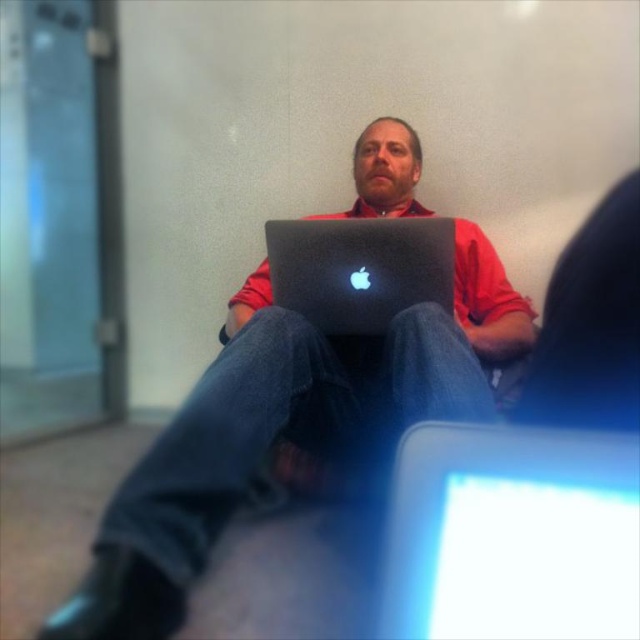
You are a delivery person who needs to place a package on the desk where the sleek silver laptop at center is located. The package requires a minimum of 10 cm of space to the left and right of the laptop. Can you determine if there is enough space on the desk around the laptop?

The sleek silver laptop at center is located at point [512,532]. However, without knowing the desk dimensions or the available space around the laptop, it is impossible to determine if there is enough space to place the package with the required 10 cm clearance on both sides. Additional information about the desk size and the laptop position relative to desk edges is needed to make this assessment.

You are standing in the room and want to move from the point at the bottom left corner to the point at the bottom right corner. There are two points marked in the image, one at coordinates point (291, 392) and another at point (444, 625). Which point is closer to your starting position at the bottom left corner?

The point at (291, 392) is closer to the bottom left corner because it is positioned behind the point at (444, 625), meaning it is nearer to the starting point.

You are a delivery person who needs to place a small package on the desk next to the sleek silver laptop at center. The package is 12 inches long. Can you fit the package horizontally next to the laptop without moving it?

The sleek silver laptop at center is 13.05 inches away from the viewer. Since the package is 12 inches long, it can fit horizontally next to the laptop as the distance available is slightly more than the package length.